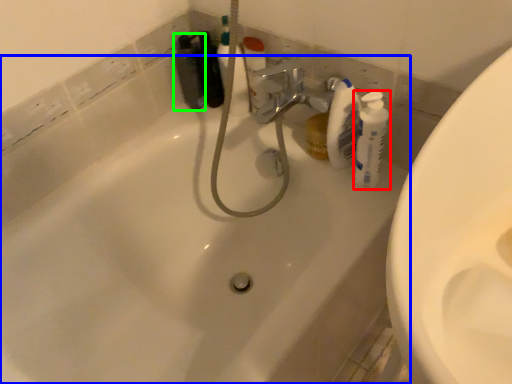
Question: Based on their relative distances, which object is farther from cleaning product (highlighted by a red box)? Choose from bathtub (highlighted by a blue box) and toiletry (highlighted by a green box).

Choices:
 (A) bathtub
 (B) toiletry

Answer: (B)